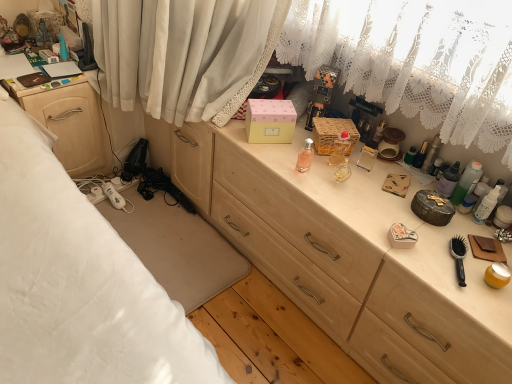
Question: Considering their positions, is white glossy lotion at right, which ranks as the first toiletry in right-to-left order, located in front of or behind pink glass perfume at center, the first toiletry in the left-to-right sequence?

Choices:
 (A) front
 (B) behind

Answer: (A)

Question: In terms of height, does white glossy lotion at right, which ranks as the first toiletry in right-to-left order, look taller or shorter compared to pink glass perfume at center, the first toiletry in the left-to-right sequence?

Choices:
 (A) short
 (B) tall

Answer: (B)

Question: Which of these objects is positioned farthest from the pink matte box at center?

Choices:
 (A) translucent plastic bottles at right, the second toiletry when ordered from right to left
 (B) translucent glass perfume at center, acting as the 4th toiletry starting from the right
 (C) translucent plastic bottles at right, the 3th toiletry in the right-to-left sequence
 (D) matte wood nightstand at left
 (E) light wood desk at center

Answer: (D)

Question: Which object is the closest to the white glossy lotion at right, which ranks as the first toiletry in right-to-left order?

Choices:
 (A) woven brown picnic basket at center
 (B) translucent glass perfume at center, acting as the 4th toiletry starting from the right
 (C) translucent plastic bottles at right, which ranks as the third toiletry in left-to-right order
 (D) pink glass perfume at center, marked as the 5th toiletry in a right-to-left arrangement
 (E) pink matte box at center

Answer: (C)